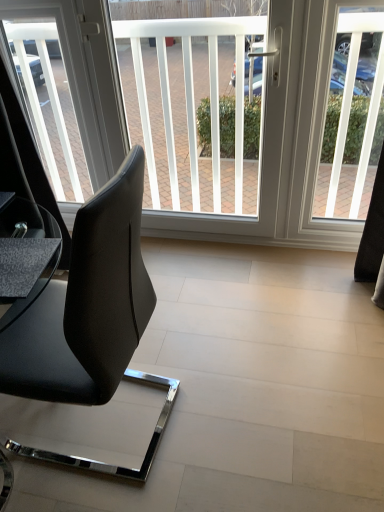
Where is `vacant area in front of white plastic window screen at center, the 2th window screen in the left-to-right sequence`? vacant area in front of white plastic window screen at center, the 2th window screen in the left-to-right sequence is located at coordinates (215, 292).